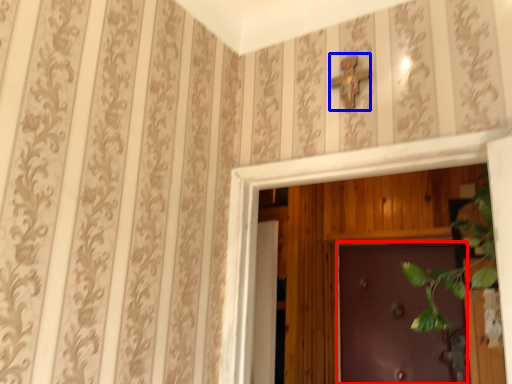
Question: Which object appears farthest to the camera in this image, door (highlighted by a red box) or cross (highlighted by a blue box)?

Choices:
 (A) door
 (B) cross

Answer: (A)